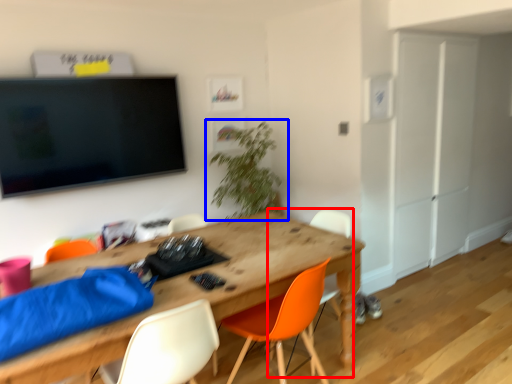
Question: Which point is further to the camera, chair (highlighted by a red box) or houseplant (highlighted by a blue box)?

Choices:
 (A) chair
 (B) houseplant

Answer: (B)